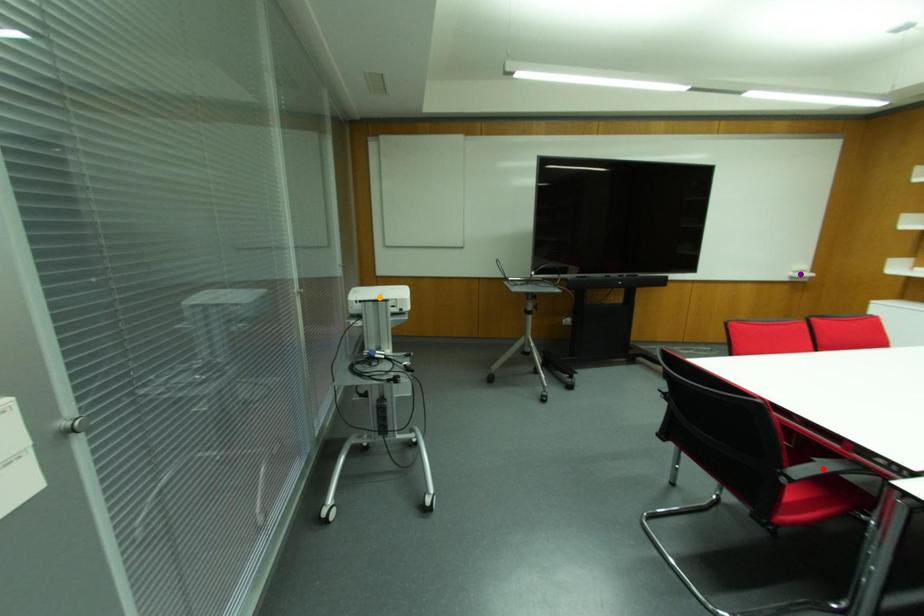
Consider the image. Order these from nearest to farthest:
1. orange point
2. purple point
3. red point

red point < orange point < purple point